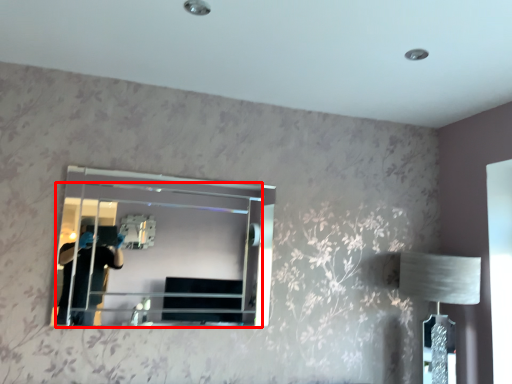
Question: From the image, what is the correct spatial relationship of mirror (annotated by the red box) in relation to table lamp?

Choices:
 (A) right
 (B) left

Answer: (B)